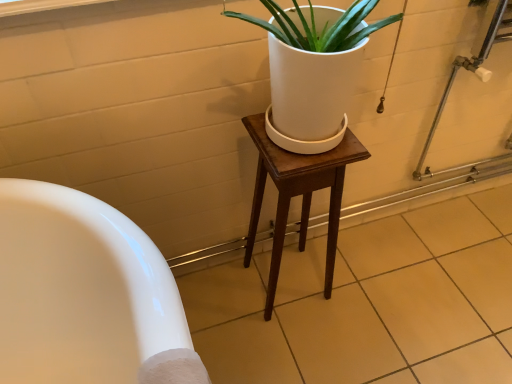
The height and width of the screenshot is (384, 512). What are the coordinates of `wooden stool at center` in the screenshot? It's located at click(x=297, y=194).

Describe the element at coordinates (297, 194) in the screenshot. This screenshot has height=384, width=512. I see `wooden stool at center` at that location.

In order to face white glossy tile at lower left, should I rotate leftwards or rightwards?

Turn right by 11.551 degrees to look at white glossy tile at lower left.

What is the approximate height of white glossy tile at lower left?

white glossy tile at lower left is 1.87 inches in height.

The image size is (512, 384). What are the coordinates of `white glossy tile at lower left` in the screenshot? It's located at (370, 303).

Describe the element at coordinates (370, 303) in the screenshot. I see `white glossy tile at lower left` at that location.

The height and width of the screenshot is (384, 512). I want to click on wooden stool at center, so click(x=297, y=194).

Can you confirm if white glossy tile at lower left is positioned to the right of wooden stool at center?

Correct, you'll find white glossy tile at lower left to the right of wooden stool at center.

Does white glossy tile at lower left come behind wooden stool at center?

Yes, it is.

Does point (193, 285) appear closer or farther from the camera than point (258, 213)?

Point (193, 285).

From the image's perspective, is white glossy tile at lower left above or below wooden stool at center?

white glossy tile at lower left is situated lower than wooden stool at center in the image.

Based on the photo, from a real-world perspective, is white glossy tile at lower left below wooden stool at center?

Yes, from a real-world perspective, white glossy tile at lower left is beneath wooden stool at center.

Considering the sizes of objects white glossy tile at lower left and wooden stool at center in the image provided, who is wider, white glossy tile at lower left or wooden stool at center?

Wider between the two is white glossy tile at lower left.

Is white glossy tile at lower left taller than wooden stool at center?

In fact, white glossy tile at lower left may be shorter than wooden stool at center.

Is white glossy tile at lower left bigger or smaller than wooden stool at center?

In the image, white glossy tile at lower left appears to be larger than wooden stool at center.

Is white glossy tile at lower left positioned beyond the bounds of wooden stool at center?

Indeed, white glossy tile at lower left is completely outside wooden stool at center.

Is white glossy tile at lower left not close to wooden stool at center?

No, white glossy tile at lower left is not far away from wooden stool at center.

Is white glossy tile at lower left oriented towards wooden stool at center?

No, white glossy tile at lower left is not aimed at wooden stool at center.

How different are the orientations of white glossy tile at lower left and wooden stool at center in degrees?

The angular difference between white glossy tile at lower left and wooden stool at center is 0.355 degrees.

I want to click on stool in front of the white glossy tile at lower left, so click(297, 194).

Based on their positions, is wooden stool at center located to the left or right of white glossy tile at lower left?

Based on their positions, wooden stool at center is located to the left of white glossy tile at lower left.

Relative to white glossy tile at lower left, is wooden stool at center in front or behind?

wooden stool at center is in front of white glossy tile at lower left.

Does point (334, 197) come behind point (391, 225)?

No, it is in front of (391, 225).

From the image's perspective, is wooden stool at center located above or below white glossy tile at lower left?

wooden stool at center is situated higher than white glossy tile at lower left in the image.

From a real-world perspective, between wooden stool at center and white glossy tile at lower left, who is vertically higher?

wooden stool at center, from a real-world perspective.

Does wooden stool at center have a greater width compared to white glossy tile at lower left?

In fact, wooden stool at center might be narrower than white glossy tile at lower left.

Considering the relative sizes of wooden stool at center and white glossy tile at lower left in the image provided, is wooden stool at center shorter than white glossy tile at lower left?

No, wooden stool at center is not shorter than white glossy tile at lower left.

In the scene shown: Considering the sizes of objects wooden stool at center and white glossy tile at lower left in the image provided, who is smaller, wooden stool at center or white glossy tile at lower left?

Smaller between the two is wooden stool at center.

Is white glossy tile at lower left completely or partially inside wooden stool at center?

Actually, white glossy tile at lower left is outside wooden stool at center.

Is wooden stool at center not near white glossy tile at lower left?

wooden stool at center is near white glossy tile at lower left, not far away.

Is wooden stool at center facing towards white glossy tile at lower left?

No.

Can you tell me how much wooden stool at center and white glossy tile at lower left differ in facing direction?

The angular difference between wooden stool at center and white glossy tile at lower left is 0.355 degrees.

Measure the distance from wooden stool at center to white glossy tile at lower left.

wooden stool at center and white glossy tile at lower left are 12.38 inches apart.

You are a GUI agent. You are given a task and a screenshot of the screen. Output one action in this format:
    pyautogui.click(x=<x>, y=<y>)
    Task: Click on the stool to the left of white glossy tile at lower left
    This screenshot has height=384, width=512.
    Given the screenshot: What is the action you would take?
    coord(297,194)

This screenshot has width=512, height=384. In order to click on stool in front of the white glossy tile at lower left in this screenshot , I will do pos(297,194).

Where is `tile behind the wooden stool at center`? tile behind the wooden stool at center is located at coordinates (370, 303).